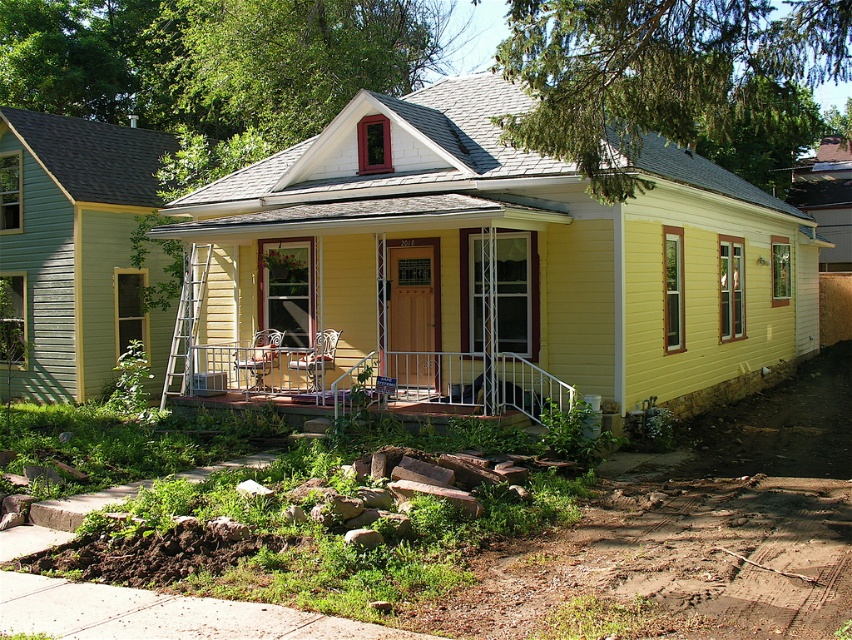
Who is positioned more to the left, metallic white railing at center or silver metallic ladder at lower left?

From the viewer's perspective, silver metallic ladder at lower left appears more on the left side.

What do you see at coordinates (367, 378) in the screenshot? The width and height of the screenshot is (852, 640). I see `metallic white railing at center` at bounding box center [367, 378].

The image size is (852, 640). Describe the element at coordinates (367, 378) in the screenshot. I see `metallic white railing at center` at that location.

Identify the location of metallic white railing at center. [x=367, y=378].

Is point (177, 305) positioned after point (269, 371)?

That is True.

Is point (199, 280) in front of point (275, 362)?

No, it is not.

Locate an element on the screen. silver metallic ladder at lower left is located at coordinates (186, 321).

Which of these two, metallic white railing at center or metallic silver rocking chair at center, stands taller?

metallic silver rocking chair at center is taller.

Does metallic white railing at center have a lesser height compared to metallic silver rocking chair at center?

Indeed, metallic white railing at center has a lesser height compared to metallic silver rocking chair at center.

Between point (367, 397) and point (252, 355), which one is positioned behind?

The point (252, 355) is behind.

Locate an element on the screen. This screenshot has height=640, width=852. metallic white railing at center is located at coordinates (367, 378).